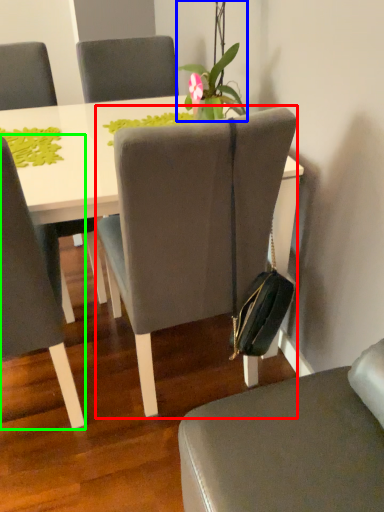
Question: Which object is positioned closest to chair (highlighted by a red box)? Select from houseplant (highlighted by a blue box) and chair (highlighted by a green box).

Choices:
 (A) houseplant
 (B) chair

Answer: (B)